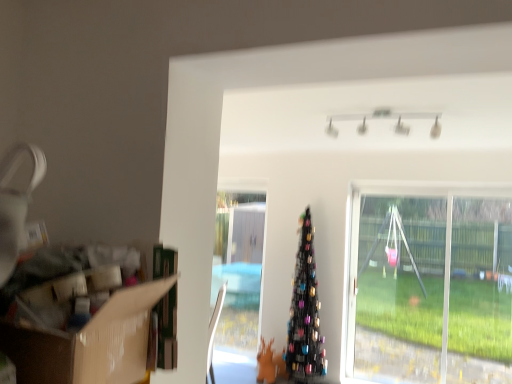
This screenshot has height=384, width=512. What do you see at coordinates (431, 286) in the screenshot?
I see `transparent plastic swing at right` at bounding box center [431, 286].

Locate an element on the screen. Image resolution: width=512 pixels, height=384 pixels. cardboard box at left is located at coordinates (90, 342).

I want to click on transparent plastic swing at right, so click(x=431, y=286).

Is black metallic christmas tree at center inside the boundaries of transparent plastic swing at right, or outside?

black metallic christmas tree at center cannot be found inside transparent plastic swing at right.

Between point (302, 353) and point (368, 242), which one is positioned in front?

The point (302, 353) is closer.

Which object is wider, black metallic christmas tree at center or transparent plastic swing at right?

Wider between the two is black metallic christmas tree at center.

Is black metallic christmas tree at center facing towards transparent plastic swing at right?

No.

Is cardboard box at left placed right next to transparent plastic swing at right?

No, cardboard box at left is not next to transparent plastic swing at right.

Looking at this image, from the image's perspective, which object appears higher, cardboard box at left or transparent plastic swing at right?

cardboard box at left appears higher in the image.

Looking at the image, does cardboard box at left seem bigger or smaller compared to transparent plastic swing at right?

Clearly, cardboard box at left is smaller in size than transparent plastic swing at right.

Between point (40, 359) and point (504, 218), which one is positioned in front?

The point (40, 359) is more forward.

Relative to cardboard box at left, is transparent plastic swing at right in front or behind?

transparent plastic swing at right is behind cardboard box at left.

Based on the photo, is cardboard box at left completely or partially inside transparent plastic swing at right?

That's incorrect, cardboard box at left is not inside transparent plastic swing at right.

From the image's perspective, which is below, transparent plastic swing at right or cardboard box at left?

From the image's view, transparent plastic swing at right is below.

Considering the sizes of objects cardboard box at left and black metallic christmas tree at center in the image provided, who is smaller, cardboard box at left or black metallic christmas tree at center?

cardboard box at left is smaller.

From a real-world perspective, is cardboard box at left over black metallic christmas tree at center?

Yes, from a real-world perspective, cardboard box at left is over black metallic christmas tree at center

The height and width of the screenshot is (384, 512). What are the coordinates of `christmas tree below the cardboard box at left (from the image's perspective)` in the screenshot? It's located at (305, 314).

From the image's perspective, is cardboard box at left below black metallic christmas tree at center?

Incorrect, from the image's perspective, cardboard box at left is higher than black metallic christmas tree at center.

From the image's perspective, is transparent plastic swing at right on top of black metallic christmas tree at center?

Yes, from the image's perspective, transparent plastic swing at right is over black metallic christmas tree at center.

What's the angular difference between transparent plastic swing at right and black metallic christmas tree at center's facing directions?

The angle between the facing direction of transparent plastic swing at right and the facing direction of black metallic christmas tree at center is 0.00201 degrees.

Considering the points (364, 216) and (318, 324), which point is behind, point (364, 216) or point (318, 324)?

The point (364, 216) is behind.

Find the location of a particular element. window above the black metallic christmas tree at center (from a real-world perspective) is located at coordinates (431, 286).

Based on the photo, is black metallic christmas tree at center looking in the opposite direction of cardboard box at left?

black metallic christmas tree at center does not have its back to cardboard box at left.

Choose the correct answer: Is black metallic christmas tree at center inside cardboard box at left or outside it?

The correct answer is: outside.

Identify the location of christmas tree that appears below the cardboard box at left (from a real-world perspective). pos(305,314).

Measure the distance between black metallic christmas tree at center and cardboard box at left.

black metallic christmas tree at center is 3.32 meters away from cardboard box at left.

The image size is (512, 384). Identify the location of christmas tree below the transparent plastic swing at right (from the image's perspective). (305, 314).

Identify the location of window below the cardboard box at left (from a real-world perspective). (431, 286).

Based on their spatial positions, is transparent plastic swing at right or cardboard box at left further from black metallic christmas tree at center?

cardboard box at left.

From the image, which object appears to be farther from transparent plastic swing at right, black metallic christmas tree at center or cardboard box at left?

Among the two, cardboard box at left is located further to transparent plastic swing at right.

Looking at the image, which one is located further to cardboard box at left, transparent plastic swing at right or black metallic christmas tree at center?

transparent plastic swing at right.

Which object lies further to the anchor point black metallic christmas tree at center, cardboard box at left or transparent plastic swing at right?

Among the two, cardboard box at left is located further to black metallic christmas tree at center.

From the image, which object appears to be farther from transparent plastic swing at right, cardboard box at left or black metallic christmas tree at center?

cardboard box at left lies further to transparent plastic swing at right than the other object.

Estimate the real-world distances between objects in this image. Which object is closer to cardboard box at left, black metallic christmas tree at center or transparent plastic swing at right?

black metallic christmas tree at center is positioned closer to the anchor cardboard box at left.

Locate an element on the screen. Image resolution: width=512 pixels, height=384 pixels. window between cardboard box at left and black metallic christmas tree at center from front to back is located at coordinates (431, 286).